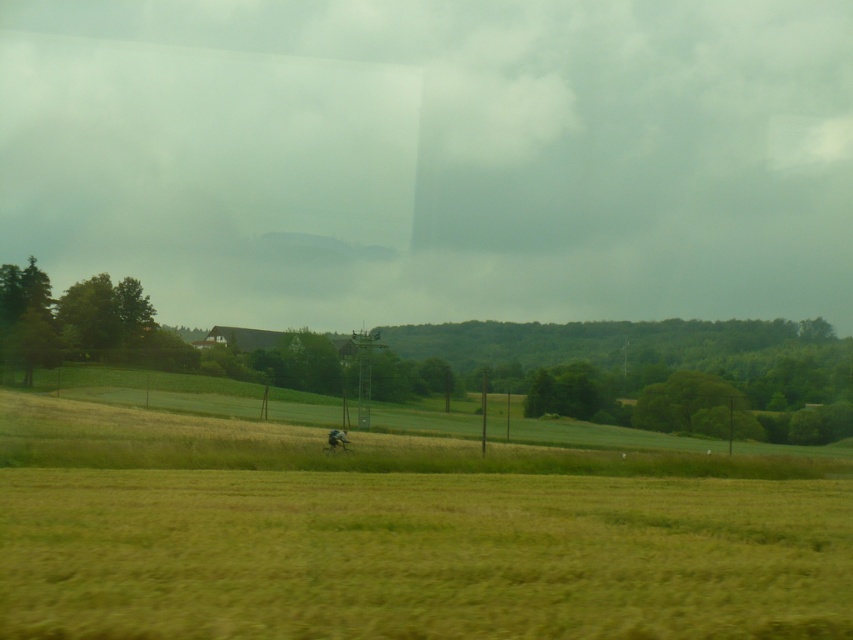
You are standing in the rural landscape described. You see the green grassy field at center and the brown fur dog at center. Which object is closer to the ground?

The green grassy field at center is closer to the ground as it is located below the brown fur dog at center.

You are standing in the rural landscape and see the green grassy field at center and the brown fur dog at center. Which object is positioned to the right of the other?

The green grassy field at center is to the right of the brown fur dog at center.

You are standing in the rural landscape described. You need to walk from the green grassy field at center to the brown fur dog at center. Since both are at the center, how do you determine which direction to go?

The green grassy field at center is wider than the brown fur dog at center, so you should walk towards the narrower area where the brown fur dog at center is located.